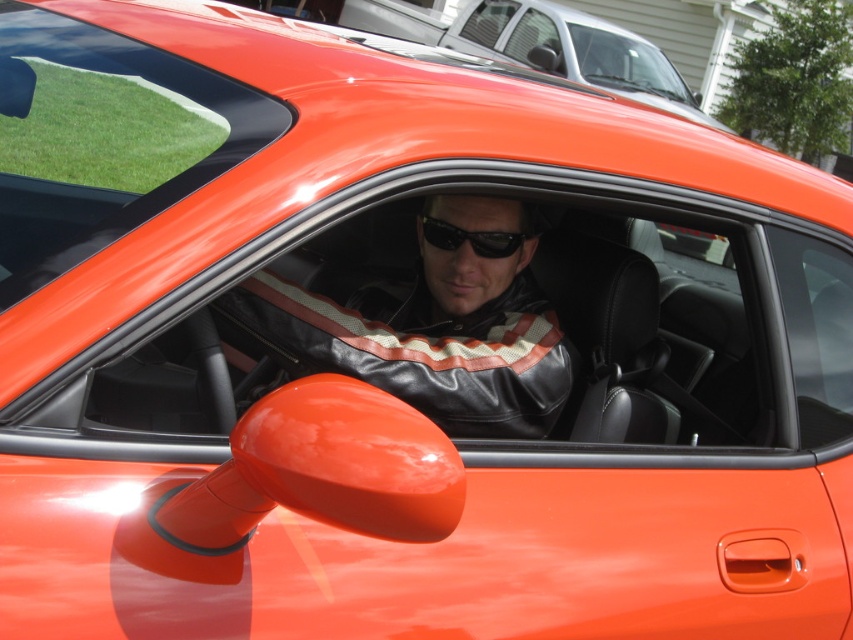
You are standing in front of the orange sports car and want to locate the leather jacket at center. According to the coordinates provided, where would you look to find it?

The leather jacket at center is located at coordinates point (433, 324).

You are a fashion photographer and want to capture a closeup shot of the leather jacket at center and the black matte sunglasses at center. Which object should you focus on first to ensure both are in focus without adjusting the camera settings?

Since the leather jacket at center is closer to the viewer than the black matte sunglasses at center, you should focus on the leather jacket at center first. This way, the sunglasses will be slightly out of focus, but adjusting the focus to the middle distance between them might help both appear sharp. However, without changing settings, focusing on the closer object ensures it is in focus while the farther one may be slightly blurred.